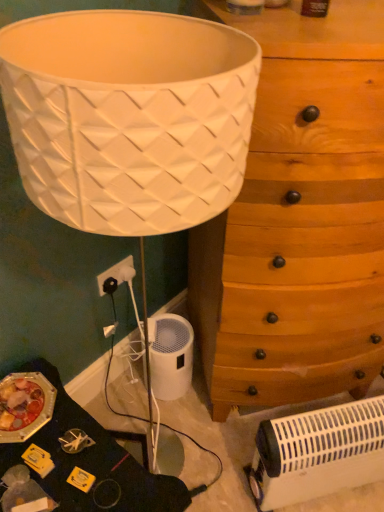
Looking at this image, what is the approximate width of white plastic electric outlet at lower left?

It is 1.62 inches.

Where is `white plastic electric outlet at lower left`? This screenshot has height=512, width=384. white plastic electric outlet at lower left is located at coordinates (113, 273).

How different are the orientations of white plastic heater at lower right and white plastic electric outlet at lower left in degrees?

There is a 35.3-degree angle between the facing directions of white plastic heater at lower right and white plastic electric outlet at lower left.

Considering the sizes of objects white plastic heater at lower right and white plastic electric outlet at lower left in the image provided, who is bigger, white plastic heater at lower right or white plastic electric outlet at lower left?

With larger size is white plastic heater at lower right.

Which of these two, white plastic heater at lower right or white plastic electric outlet at lower left, stands shorter?

Standing shorter between the two is white plastic electric outlet at lower left.

At what (x,y) coordinates should I click in order to perform the action: click on electric outlet lying above the white plastic heater at lower right (from the image's perspective). Please return your answer as a coordinate pair (x, y). Looking at the image, I should click on (113, 273).

Which is behind, wooden chest of drawers at center-right or white plastic heater at lower right?

white plastic heater at lower right is further from the camera.

Does wooden chest of drawers at center-right touch white plastic heater at lower right?

No, wooden chest of drawers at center-right is not in contact with white plastic heater at lower right.

Does wooden chest of drawers at center-right appear on the left side of white plastic heater at lower right?

Correct, you'll find wooden chest of drawers at center-right to the left of white plastic heater at lower right.

From a real-world perspective, which object rests below the other?

white plastic heater at lower right.

From the image's perspective, does white plastic electric outlet at lower left appear lower than white plastic heater at lower right?

No, from the image's perspective, white plastic electric outlet at lower left is not beneath white plastic heater at lower right.

From a real-world perspective, is white plastic electric outlet at lower left physically above white plastic heater at lower right?

Yes.

In terms of height, does white plastic electric outlet at lower left look taller or shorter compared to white plastic heater at lower right?

Considering their sizes, white plastic electric outlet at lower left has less height than white plastic heater at lower right.

Consider the image. Between white plastic heater at lower right and wooden chest of drawers at center-right, which one is positioned behind?

white plastic heater at lower right.

From a real-world perspective, relative to wooden chest of drawers at center-right, is white plastic heater at lower right vertically above or below?

white plastic heater at lower right is below wooden chest of drawers at center-right.

Are white plastic heater at lower right and wooden chest of drawers at center-right far apart?

Actually, white plastic heater at lower right and wooden chest of drawers at center-right are a little close together.

How different are the orientations of white plastic heater at lower right and wooden chest of drawers at center-right in degrees?

They differ by 2.87 degrees in their facing directions.

Which object is wider, wooden chest of drawers at center-right or white plastic electric outlet at lower left?

Wider between the two is wooden chest of drawers at center-right.

Is wooden chest of drawers at center-right far away from white plastic electric outlet at lower left?

No, wooden chest of drawers at center-right is not far away from white plastic electric outlet at lower left.

Considering the positions of objects wooden chest of drawers at center-right and white plastic electric outlet at lower left in the image provided, who is more to the right, wooden chest of drawers at center-right or white plastic electric outlet at lower left?

From the viewer's perspective, wooden chest of drawers at center-right appears more on the right side.

From the image's perspective, is white plastic electric outlet at lower left positioned above or below wooden chest of drawers at center-right?

From the image's perspective, white plastic electric outlet at lower left appears below wooden chest of drawers at center-right.

Considering the sizes of objects white plastic electric outlet at lower left and wooden chest of drawers at center-right in the image provided, who is shorter, white plastic electric outlet at lower left or wooden chest of drawers at center-right?

white plastic electric outlet at lower left is shorter.

Relative to wooden chest of drawers at center-right, is white plastic electric outlet at lower left in front or behind?

Visually, white plastic electric outlet at lower left is located behind wooden chest of drawers at center-right.

Image resolution: width=384 pixels, height=512 pixels. What are the coordinates of `electric outlet lying behind the white plastic heater at lower right` in the screenshot? It's located at (113, 273).

Where is `the chest of drawers that is in front of the white plastic heater at lower right`? the chest of drawers that is in front of the white plastic heater at lower right is located at coordinates (296, 234).

Estimate the real-world distances between objects in this image. Which object is closer to wooden chest of drawers at center-right, white plastic electric outlet at lower left or white plastic heater at lower right?

Based on the image, white plastic heater at lower right appears to be nearer to wooden chest of drawers at center-right.

From the image, which object appears to be farther from white plastic electric outlet at lower left, white plastic heater at lower right or wooden chest of drawers at center-right?

Based on the image, white plastic heater at lower right appears to be further to white plastic electric outlet at lower left.

Looking at the image, which one is located further to white plastic electric outlet at lower left, wooden chest of drawers at center-right or white plastic heater at lower right?

white plastic heater at lower right.

Considering their positions, is white plastic electric outlet at lower left positioned further to white plastic heater at lower right than wooden chest of drawers at center-right?

The object further to white plastic heater at lower right is white plastic electric outlet at lower left.

From the picture: Based on their spatial positions, is white plastic heater at lower right or white plastic electric outlet at lower left closer to wooden chest of drawers at center-right?

white plastic heater at lower right is positioned closer to the anchor wooden chest of drawers at center-right.

Estimate the real-world distances between objects in this image. Which object is further from white plastic heater at lower right, wooden chest of drawers at center-right or white plastic electric outlet at lower left?

Among the two, white plastic electric outlet at lower left is located further to white plastic heater at lower right.

Locate an element on the screen. The image size is (384, 512). chest of drawers between white plastic electric outlet at lower left and white plastic heater at lower right in the horizontal direction is located at coordinates (296, 234).